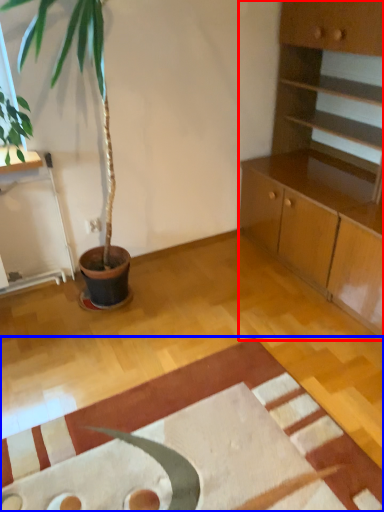
Question: Which object appears farthest to the camera in this image, cabinetry (highlighted by a red box) or mat (highlighted by a blue box)?

Choices:
 (A) cabinetry
 (B) mat

Answer: (A)